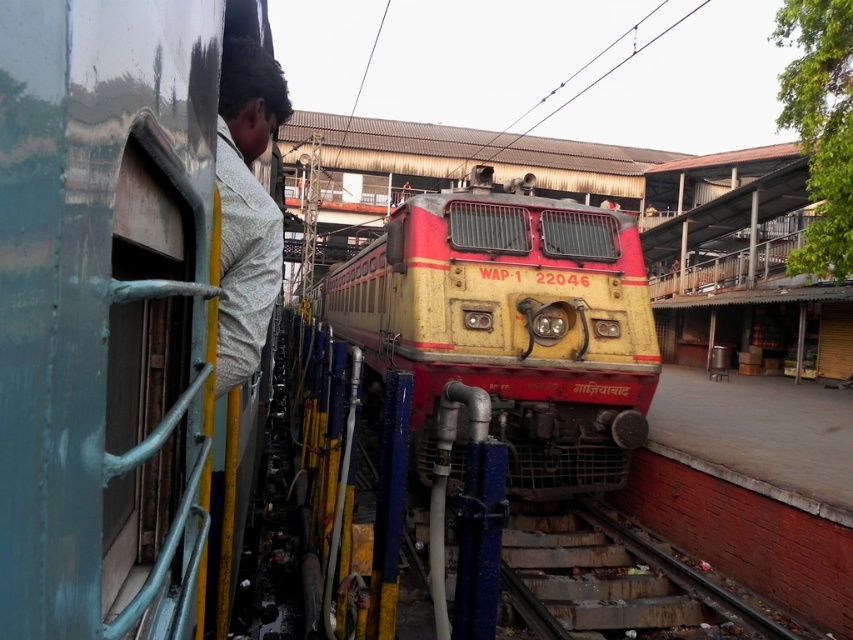
This screenshot has width=853, height=640. What do you see at coordinates (511, 324) in the screenshot? I see `yellow matte train at center` at bounding box center [511, 324].

Is point (381, 316) farther from camera compared to point (659, 602)?

Yes, point (381, 316) is farther from viewer.

Which is in front, point (450, 362) or point (662, 627)?

Point (662, 627) is in front.

You are a GUI agent. You are given a task and a screenshot of the screen. Output one action in this format:
    pyautogui.click(x=<x>, y=<y>)
    Task: Click on the yellow matte train at center
    
    Given the screenshot: What is the action you would take?
    pyautogui.click(x=511, y=324)